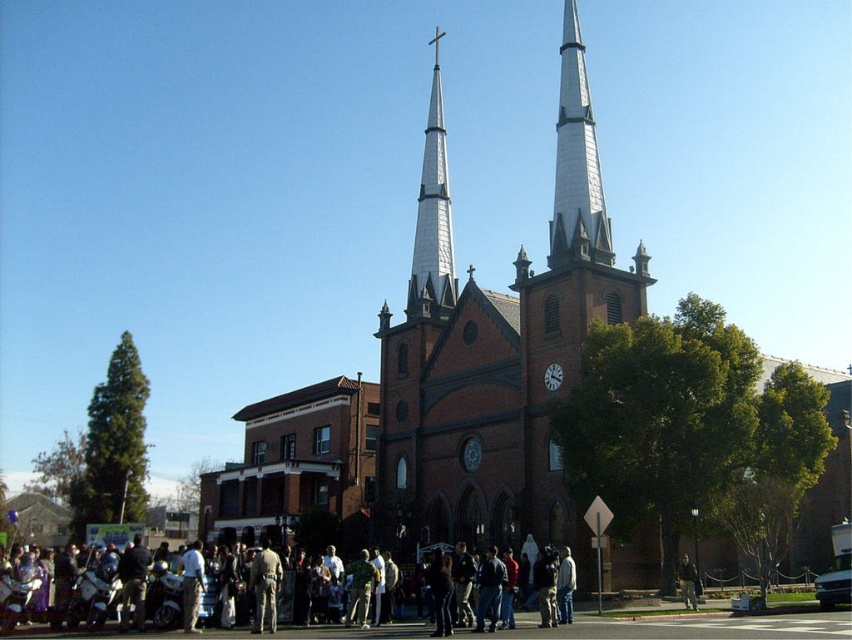
Question: Is brown brick church at center wider than white ceramic spire at upper center?

Choices:
 (A) no
 (B) yes

Answer: (B)

Question: Which object appears closest to the camera in this image?

Choices:
 (A) dark clothing at center
 (B) white ceramic spire at upper center
 (C) brown brick church at center

Answer: (A)

Question: Does camouflage pants at center appear over metallic clock face at center?

Choices:
 (A) no
 (B) yes

Answer: (A)

Question: Can you confirm if brown brick church at center is positioned below white metallic spire at center?

Choices:
 (A) no
 (B) yes

Answer: (B)

Question: Based on their relative distances, which object is farther from the white clock face at center?

Choices:
 (A) dark clothing at center
 (B) white ceramic spire at upper center

Answer: (A)

Question: Which object is positioned closest to the dark clothing at center?

Choices:
 (A) white metallic spire at center
 (B) white ceramic spire at upper center

Answer: (B)